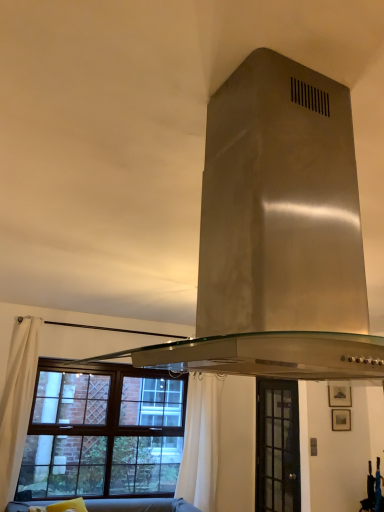
Question: From the image's perspective, is white fabric curtain at left, which is the first curtain in left-to-right order, located above or below white fabric curtain at lower center, which is the 2th curtain in left-to-right order?

Choices:
 (A) above
 (B) below

Answer: (A)

Question: Relative to white fabric curtain at lower center, arranged as the second curtain when viewed from the front, is white fabric curtain at left, marked as the 1th curtain in a front-to-back arrangement, in front or behind?

Choices:
 (A) front
 (B) behind

Answer: (A)

Question: Which object is the farthest from the soft gray fabric couch at lower center?

Choices:
 (A) white fabric curtain at left, which is the first curtain in left-to-right order
 (B) white fabric curtain at lower center, which is the 2th curtain in left-to-right order
 (C) stainless steel exhaust hood at center
 (D) clear glass door at center, which ranks as the 1th window in right-to-left order
 (E) brown wooden window at lower left, acting as the first window starting from the left

Answer: (C)

Question: Which of these objects is positioned closest to the white fabric curtain at left, marked as the 1th curtain in a front-to-back arrangement?

Choices:
 (A) white fabric curtain at lower center, which ranks as the 1th curtain in right-to-left order
 (B) stainless steel exhaust hood at center
 (C) brown wooden window at lower left, marked as the 2th window in a right-to-left arrangement
 (D) soft gray fabric couch at lower center
 (E) clear glass door at center, which ranks as the 1th window in right-to-left order

Answer: (C)